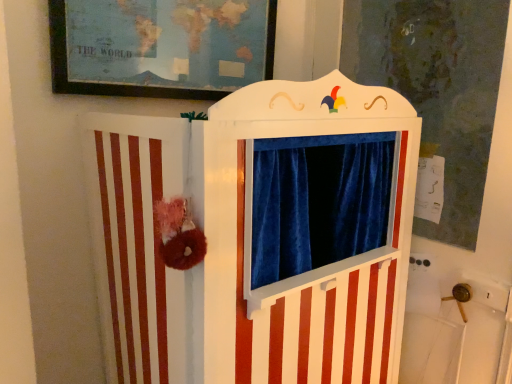
Question: From a real-world perspective, is white wood puppet theater at center under matte paper map at upper center?

Choices:
 (A) no
 (B) yes

Answer: (B)

Question: Can you confirm if white wood puppet theater at center is smaller than matte paper map at upper center?

Choices:
 (A) no
 (B) yes

Answer: (A)

Question: Considering the relative sizes of white wood puppet theater at center and matte paper map at upper center in the image provided, is white wood puppet theater at center thinner than matte paper map at upper center?

Choices:
 (A) no
 (B) yes

Answer: (A)

Question: Is matte paper map at upper center at the back of white wood puppet theater at center?

Choices:
 (A) no
 (B) yes

Answer: (A)

Question: From a real-world perspective, is white wood puppet theater at center on matte paper map at upper center?

Choices:
 (A) no
 (B) yes

Answer: (A)

Question: Is white wood puppet theater at center positioned in front of matte paper map at upper center?

Choices:
 (A) yes
 (B) no

Answer: (A)

Question: Considering the relative sizes of matte paper map at upper center and white wood puppet theater at center in the image provided, is matte paper map at upper center smaller than white wood puppet theater at center?

Choices:
 (A) no
 (B) yes

Answer: (B)

Question: From a real-world perspective, is matte paper map at upper center positioned under white wood puppet theater at center based on gravity?

Choices:
 (A) yes
 (B) no

Answer: (B)

Question: Is matte paper map at upper center positioned with its back to white wood puppet theater at center?

Choices:
 (A) yes
 (B) no

Answer: (B)

Question: From a real-world perspective, is matte paper map at upper center positioned over white wood puppet theater at center based on gravity?

Choices:
 (A) yes
 (B) no

Answer: (A)

Question: Can you confirm if matte paper map at upper center is taller than white wood puppet theater at center?

Choices:
 (A) no
 (B) yes

Answer: (A)

Question: Are matte paper map at upper center and white wood puppet theater at center located far from each other?

Choices:
 (A) yes
 (B) no

Answer: (B)

Question: Considering their positions, is white wood puppet theater at center located in front of or behind matte paper map at upper center?

Choices:
 (A) front
 (B) behind

Answer: (A)